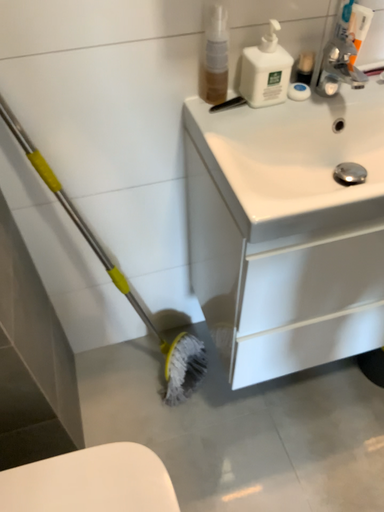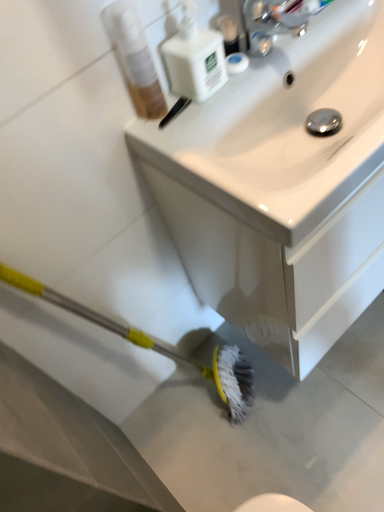
Question: Which way did the camera rotate in the video?

Choices:
 (A) rotated left
 (B) rotated right

Answer: (B)